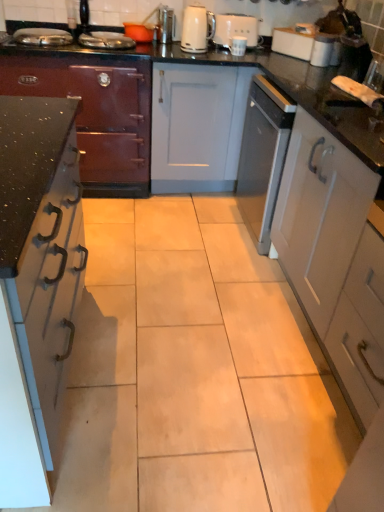
Question: From the image's perspective, is white matte coffee machine at upper center above or below satin nickel toaster at upper center, marked as the 1th appliance in a right-to-left arrangement?

Choices:
 (A) above
 (B) below

Answer: (B)

Question: In terms of height, does white matte coffee machine at upper center look taller or shorter compared to satin nickel toaster at upper center, the second appliance viewed from the left?

Choices:
 (A) tall
 (B) short

Answer: (A)

Question: Based on their relative distances, which object is farther from the black speckled countertop at left, the 2th cabinetry in the right-to-left sequence?

Choices:
 (A) orange matte bowl at upper center, the second appliance when ordered from right to left
 (B) metallic dark gray stove at left, placed as the 1th cabinetry when sorted from left to right
 (C) white matte coffee machine at upper center
 (D) black glossy countertop at center
 (E) satin nickel toaster at upper center, the second appliance viewed from the left

Answer: (C)

Question: Which of these objects is positioned closest to the white glossy electric kettle at upper center?

Choices:
 (A) satin nickel toaster at upper center, the second appliance viewed from the left
 (B) black glossy countertop at center
 (C) orange matte bowl at upper center, the second appliance when ordered from right to left
 (D) white glossy cabinet at right, the third cabinetry from the left
 (E) black speckled countertop at left, acting as the 2th cabinetry starting from the left

Answer: (A)